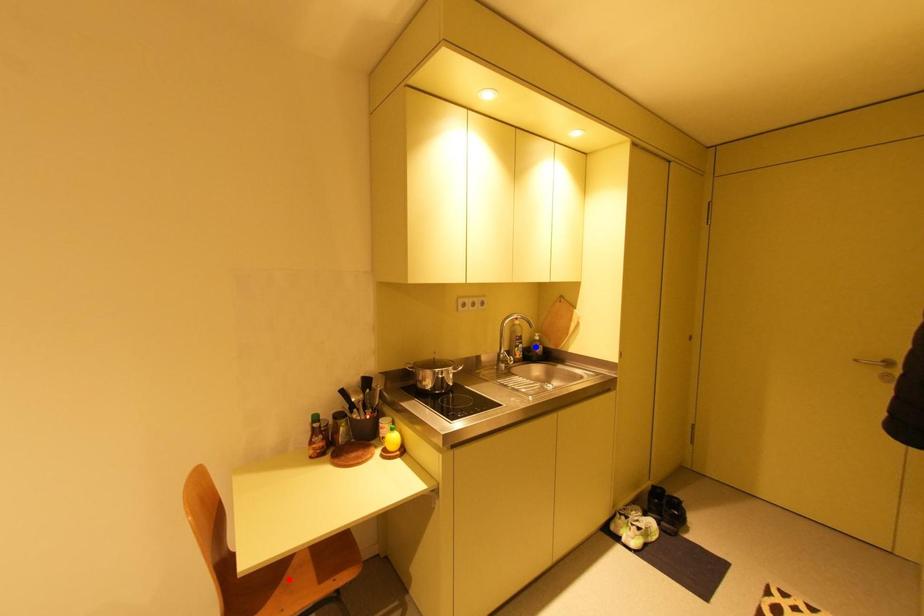
Question: In the image, two points are highlighted. Which point is nearer to the camera? Reply with the corresponding letter.

Choices:
 (A) blue point
 (B) red point

Answer: (B)